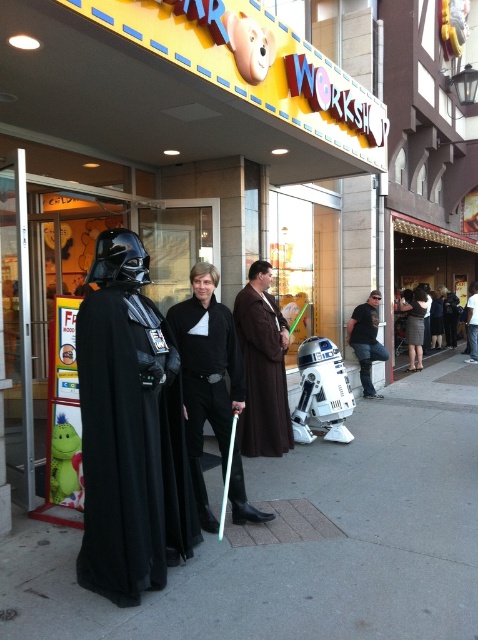
Question: Which of the following is the farthest from the observer?

Choices:
 (A) brown matte robe at center
 (B) black matte/light saber at center
 (C) black leather jacket at center
 (D) black matte cloak at left

Answer: (C)

Question: Does black matte cloak at left appear on the right side of brown matte robe at center?

Choices:
 (A) yes
 (B) no

Answer: (B)

Question: Among these points, which one is nearest to the camera?

Choices:
 (A) (272, 588)
 (B) (415, 326)

Answer: (A)

Question: Which object is farther from the camera taking this photo?

Choices:
 (A) gray concrete sidewalk at lower center
 (B) black leather jacket at center
 (C) black matte cloak at left

Answer: (B)

Question: Can you confirm if black leather jacket at center is bigger than gray textured skirt at center?

Choices:
 (A) yes
 (B) no

Answer: (B)

Question: Is gray concrete sidewalk at lower center further to the viewer compared to brown matte robe at center?

Choices:
 (A) yes
 (B) no

Answer: (B)